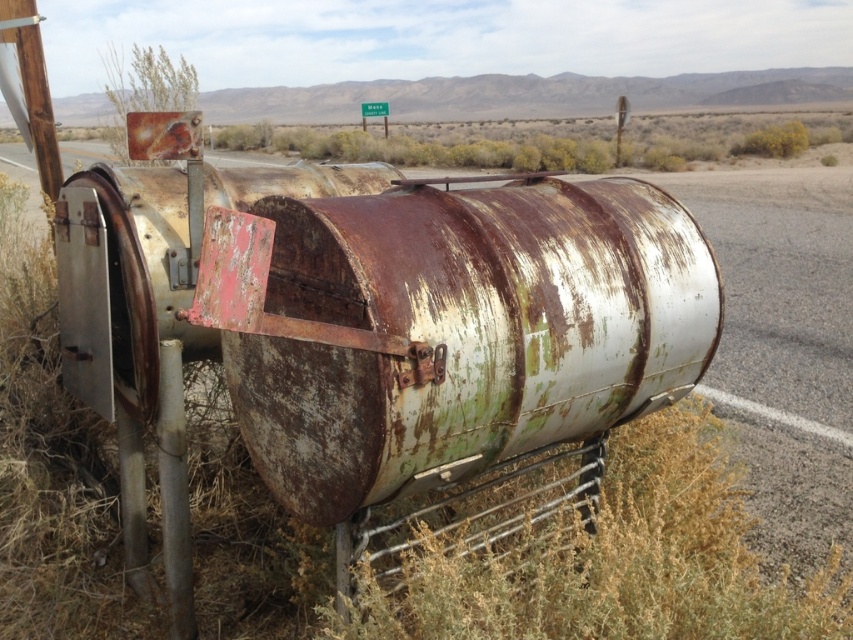
Question: Can you confirm if green matte weed at lower right is smaller than rusty metal pole at lower left?

Choices:
 (A) no
 (B) yes

Answer: (A)

Question: Can you confirm if rusty metal pole at lower left is positioned to the left of rusty metal weed at upper left?

Choices:
 (A) yes
 (B) no

Answer: (B)

Question: Is rusty metal pole at lower left to the left of rusty metal weed at upper left from the viewer's perspective?

Choices:
 (A) yes
 (B) no

Answer: (B)

Question: Which object appears closest to the camera in this image?

Choices:
 (A) rusty metal weed at upper left
 (B) green matte weed at lower right
 (C) rusty metal pole at lower left

Answer: (B)

Question: Estimate the real-world distances between objects in this image. Which object is farther from the green matte weed at lower right?

Choices:
 (A) rusty metal pole at lower left
 (B) rusty metal weed at upper left

Answer: (B)

Question: Based on their relative distances, which object is farther from the green matte weed at lower right?

Choices:
 (A) rusty metal weed at upper left
 (B) rusty metal pole at lower left

Answer: (A)